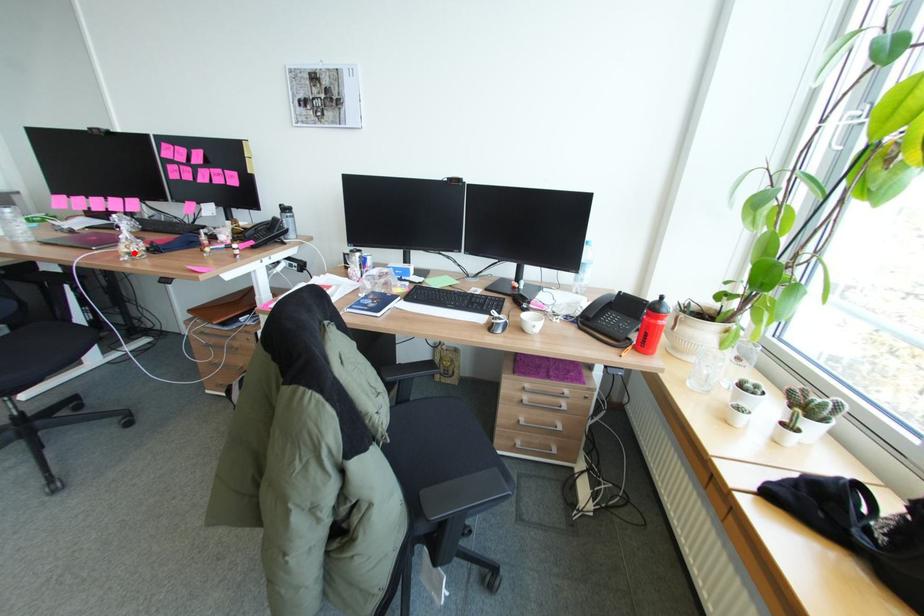
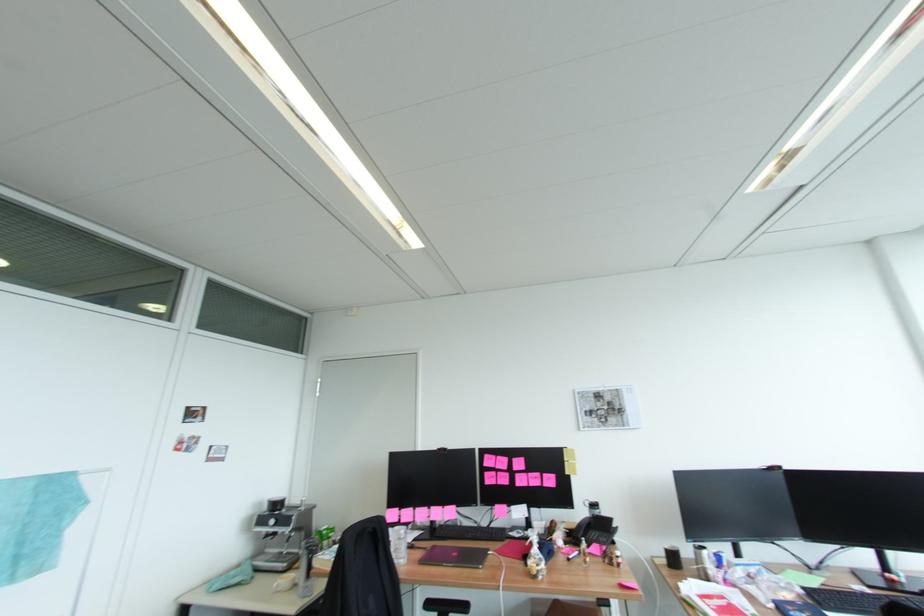
In the second image, find the point that corresponds to the highlighted location in the first image.

(546, 570)